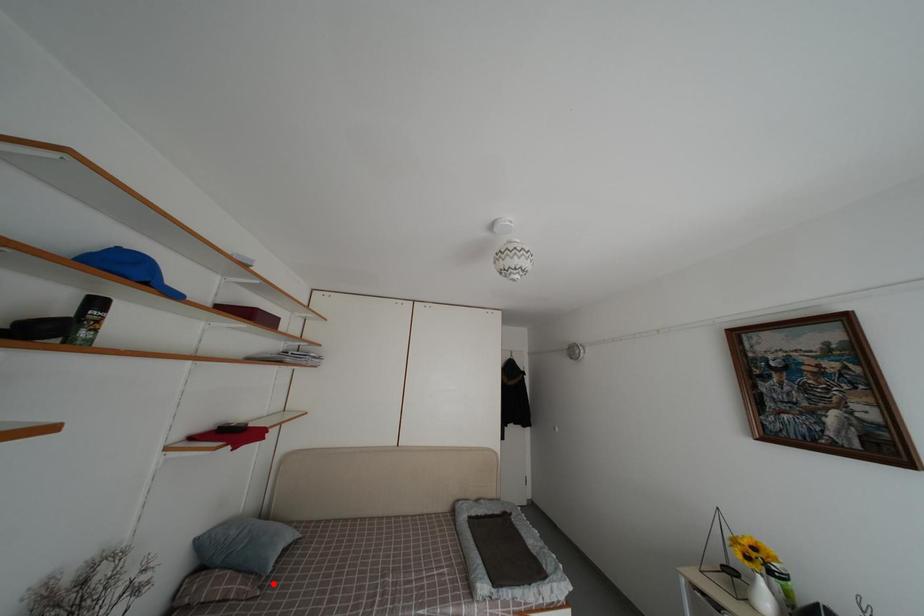
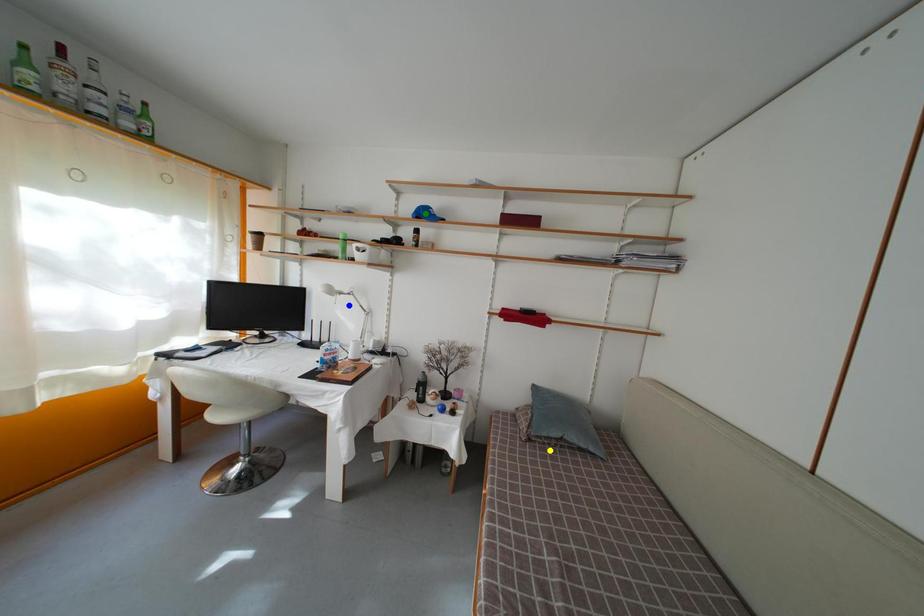
Question: I am providing you with two images of the same scene from different viewpoints. A red point is marked on the first image. You are given multiple points on the second image. In image 2, which mark is for the same physical point as the one in image 1?

Choices:
 (A) yellow point
 (B) blue point
 (C) green point

Answer: (A)